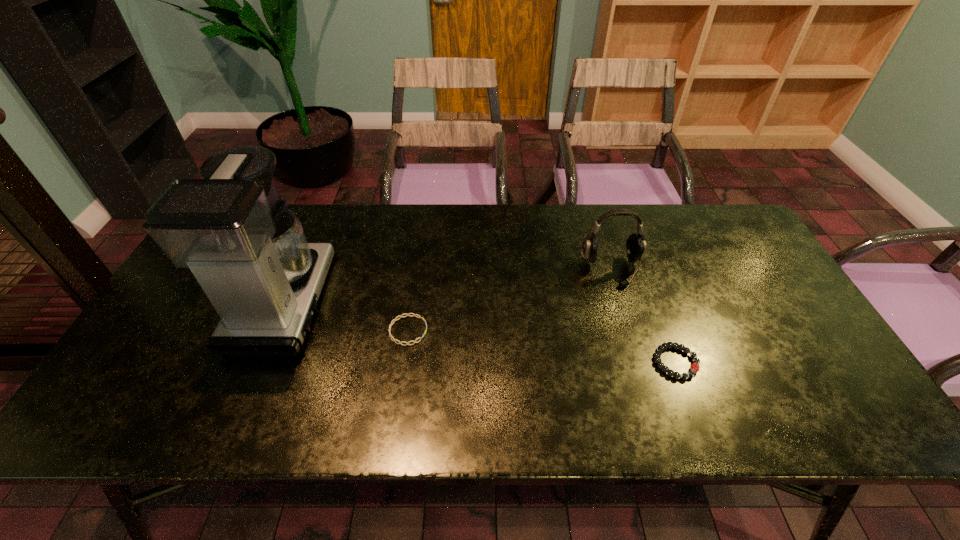
Find the location of a particular element. coffee maker is located at coordinates (249, 253).

Locate an element on the screen. the leftmost object is located at coordinates (249, 253).

This screenshot has height=540, width=960. I want to click on the second tallest object, so click(x=636, y=244).

At what (x,y) coordinates should I click in order to perform the action: click on the right bracelet. Please return your answer as a coordinate pair (x, y). Looking at the image, I should click on (694, 368).

What are the coordinates of `the taller bracelet` in the screenshot? It's located at (694, 368).

Where is `the shorter bracelet`? the shorter bracelet is located at coordinates (419, 317).

You are a GUI agent. You are given a task and a screenshot of the screen. Output one action in this format:
    pyautogui.click(x=<x>, y=<y>)
    Task: Click on the left bracelet
    
    Given the screenshot: What is the action you would take?
    point(419,317)

Identify the location of vacant space located 0.370m at the front of the coffee maker where the controls are located. Image resolution: width=960 pixels, height=540 pixels. (462, 301).

This screenshot has height=540, width=960. What are the coordinates of `vacant space situated with the microphone on the side of the second tallest object` in the screenshot? It's located at (655, 410).

You are a GUI agent. You are given a task and a screenshot of the screen. Output one action in this format:
    pyautogui.click(x=<x>, y=<y>)
    Task: Click on the vacant space located 0.380m on the left of the right bracelet
    The height and width of the screenshot is (540, 960).
    Given the screenshot: What is the action you would take?
    pyautogui.click(x=496, y=362)